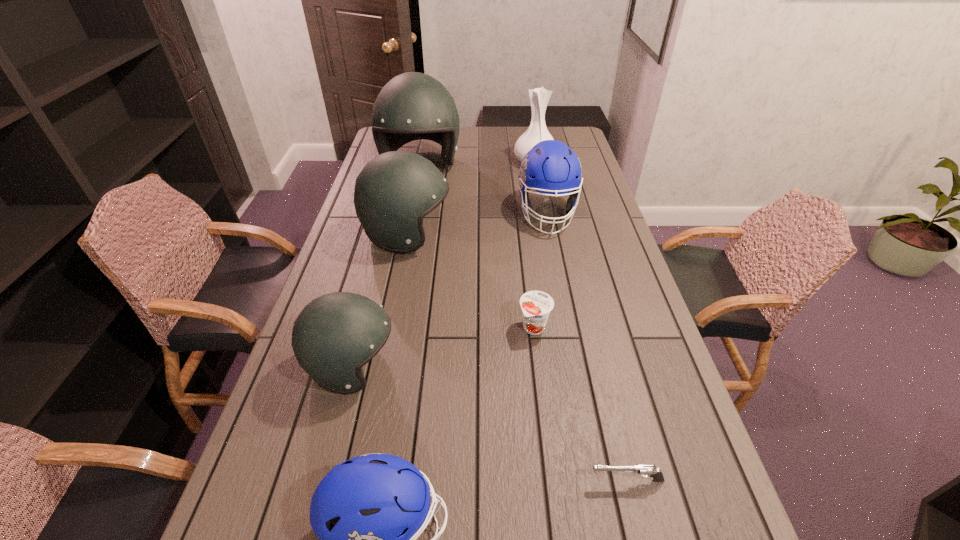
Locate an element on the screen. The height and width of the screenshot is (540, 960). vacant position in the image that satisfies the following two spatial constraints: 1. at the face opening of the farthest green football helmet; 2. on the right side of the second shortest object is located at coordinates (386, 328).

The image size is (960, 540). Identify the location of free space that satisfies the following two spatial constraints: 1. on the face guard of the rightmost football helmet; 2. at the face opening of the second nearest green football helmet. [x=551, y=235].